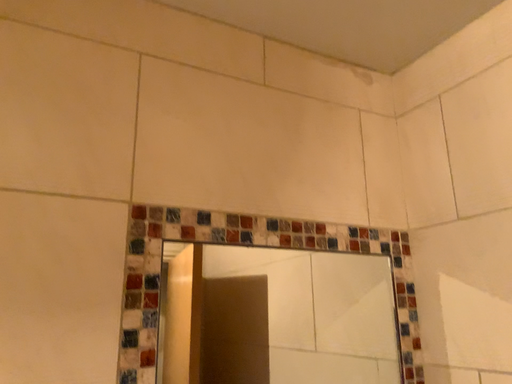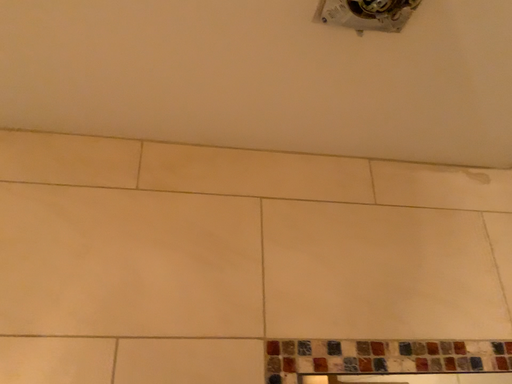
Question: Which way did the camera rotate in the video?

Choices:
 (A) rotated downward
 (B) rotated upward

Answer: (B)